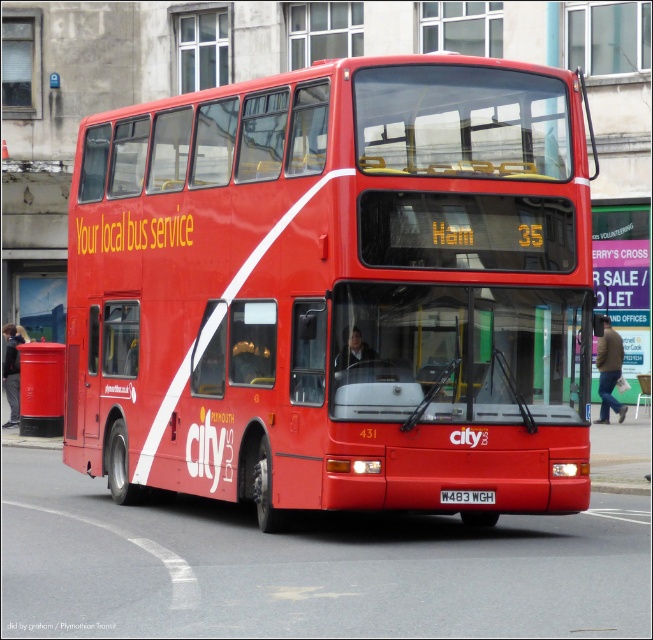
Is matte red bus at center to the left of metallic red postbox at lower left from the viewer's perspective?

Incorrect, matte red bus at center is not on the left side of metallic red postbox at lower left.

Between point (411, 426) and point (37, 420), which one is positioned behind?

The point (37, 420) is behind.

The width and height of the screenshot is (653, 640). Find the location of `matte red bus at center`. matte red bus at center is located at coordinates (338, 291).

Does matte red bus at center appear on the right side of white plastic license plate at center?

Indeed, matte red bus at center is positioned on the right side of white plastic license plate at center.

Is point (454, 116) farther from camera compared to point (488, 492)?

Yes, point (454, 116) is farther from viewer.

Where is `matte red bus at center`? matte red bus at center is located at coordinates (338, 291).

Which is more to the right, metallic red postbox at lower left or white plastic license plate at center?

From the viewer's perspective, white plastic license plate at center appears more on the right side.

Between point (35, 385) and point (439, 499), which one is positioned in front?

Point (439, 499)

This screenshot has height=640, width=653. What are the coordinates of `metallic red postbox at lower left` in the screenshot? It's located at (40, 388).